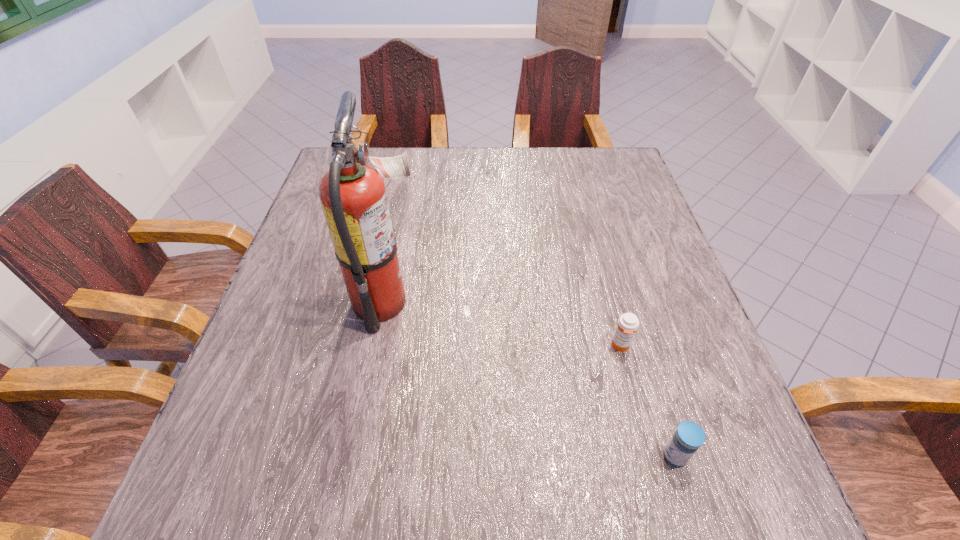
The height and width of the screenshot is (540, 960). I want to click on object positioned at the near right corner, so click(689, 436).

Find the location of `free region at the far edge of the desktop`. free region at the far edge of the desktop is located at coordinates (447, 147).

I want to click on vacant space at the near edge, so click(453, 484).

Locate an element on the screen. vacant region at the left edge of the desktop is located at coordinates (339, 286).

Locate an element on the screen. The image size is (960, 540). blank space at the right edge of the desktop is located at coordinates (595, 213).

Where is `free space at the far right corner of the desktop`? The width and height of the screenshot is (960, 540). free space at the far right corner of the desktop is located at coordinates (623, 176).

This screenshot has height=540, width=960. I want to click on free area in between the farther medicine and the nearest object, so click(x=648, y=401).

Image resolution: width=960 pixels, height=540 pixels. What are the coordinates of `vacant area between the farther medicine and the nearer medicine` in the screenshot? It's located at (648, 401).

Locate an element on the screen. This screenshot has width=960, height=540. empty space between the nearest object and the leftmost object is located at coordinates (532, 379).

Identify the location of vacant area that lies between the second object from left to right and the nearest object. The image size is (960, 540). (648, 401).